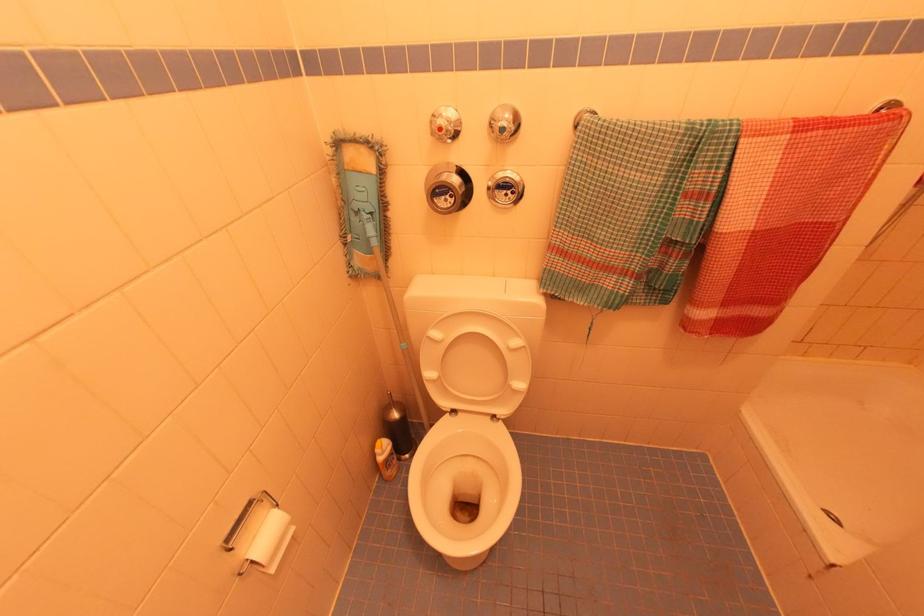
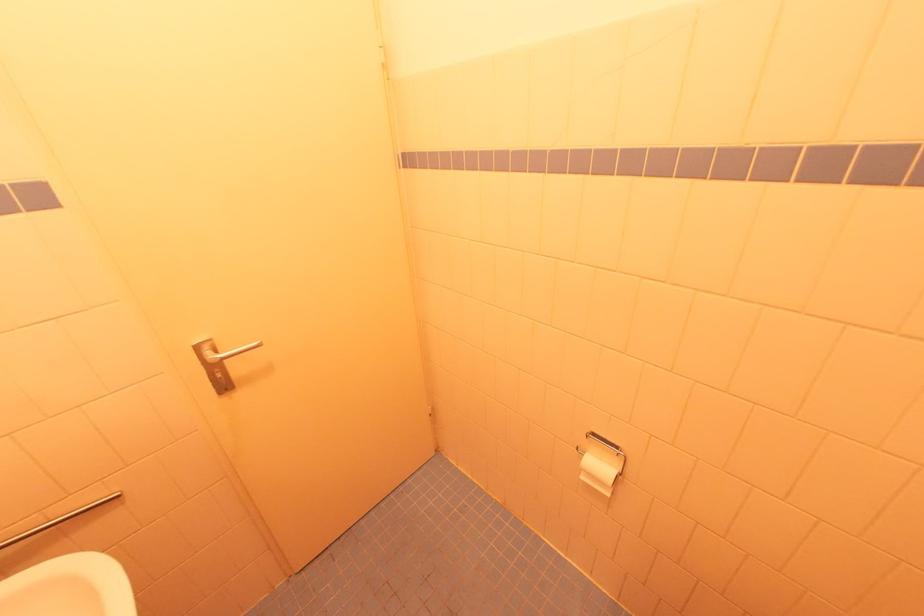
Locate, in the second image, the point that corresponds to pixel 274 570 in the first image.

(585, 479)